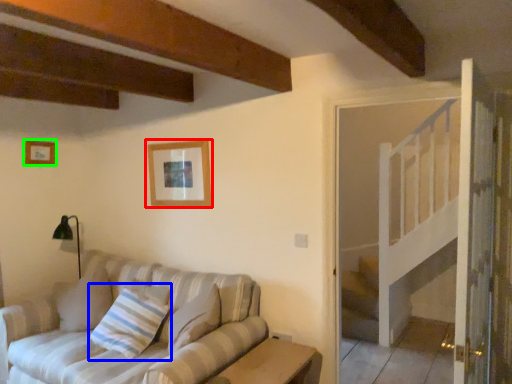
Question: Estimate the real-world distances between objects in this image. Which object is farther from picture frame (highlighted by a red box), pillow (highlighted by a blue box) or picture frame (highlighted by a green box)?

Choices:
 (A) pillow
 (B) picture frame

Answer: (B)